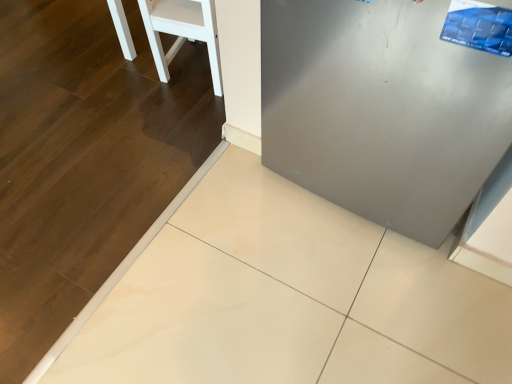
I want to click on vacant point to the left of white matte chair at upper left, so click(126, 84).